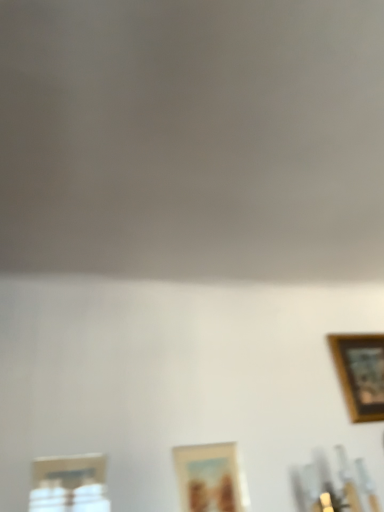
Question: From the image's perspective, is wooden picture frame at lower center, which is the second picture frame from back to front, positioned above or below metallic silver picture frame at lower left, the 3th picture frame when ordered from back to front?

Choices:
 (A) below
 (B) above

Answer: (A)

Question: Is wooden picture frame at lower center, which ranks as the second picture frame in right-to-left order, wider or thinner than metallic silver picture frame at lower left, placed as the 1th picture frame when sorted from left to right?

Choices:
 (A) thin
 (B) wide

Answer: (A)

Question: Considering the real-world distances, which object is farthest from the wooden picture frame at lower center, positioned as the 2th picture frame in front-to-back order?

Choices:
 (A) wooden framed picture at upper right, arranged as the third picture frame when viewed from the front
 (B) metallic silver picture frame at lower left, which is the third picture frame from right to left

Answer: (A)

Question: Which object is positioned farthest from the wooden picture frame at lower center, which ranks as the second picture frame in right-to-left order?

Choices:
 (A) wooden framed picture at upper right, which is the first picture frame in right-to-left order
 (B) metallic silver picture frame at lower left, placed as the 1th picture frame when sorted from left to right

Answer: (A)